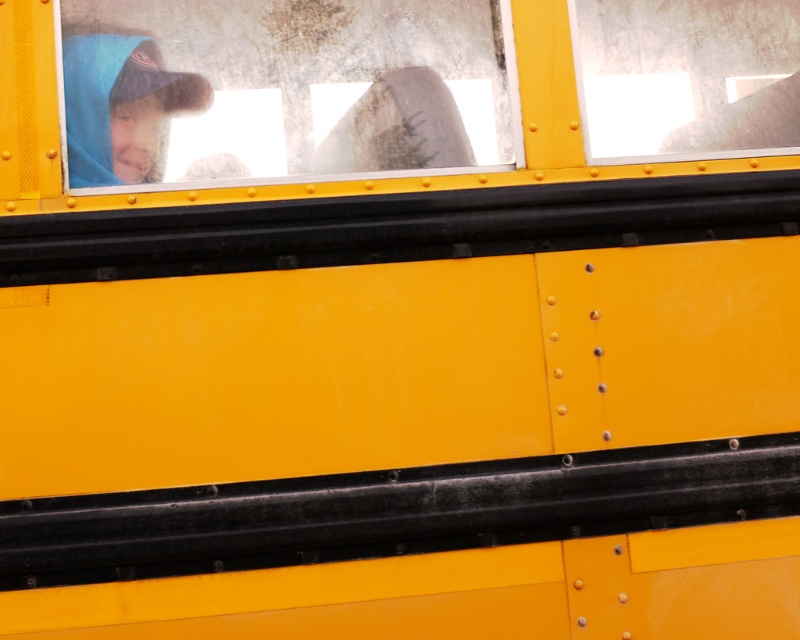
Question: Which of these objects is positioned farthest from the blue fleece at upper left?

Choices:
 (A) transparent glass window at upper left
 (B) transparent glass window at upper right

Answer: (B)

Question: Based on their relative distances, which object is nearer to the blue fleece at upper left?

Choices:
 (A) transparent glass window at upper left
 (B) transparent glass window at upper right

Answer: (A)

Question: Is transparent glass window at upper left positioned before transparent glass window at upper right?

Choices:
 (A) yes
 (B) no

Answer: (A)

Question: Is transparent glass window at upper left smaller than transparent glass window at upper right?

Choices:
 (A) no
 (B) yes

Answer: (A)

Question: Is transparent glass window at upper left closer to camera compared to blue fleece at upper left?

Choices:
 (A) no
 (B) yes

Answer: (B)

Question: Among these objects, which one is nearest to the camera?

Choices:
 (A) transparent glass window at upper right
 (B) transparent glass window at upper left

Answer: (B)